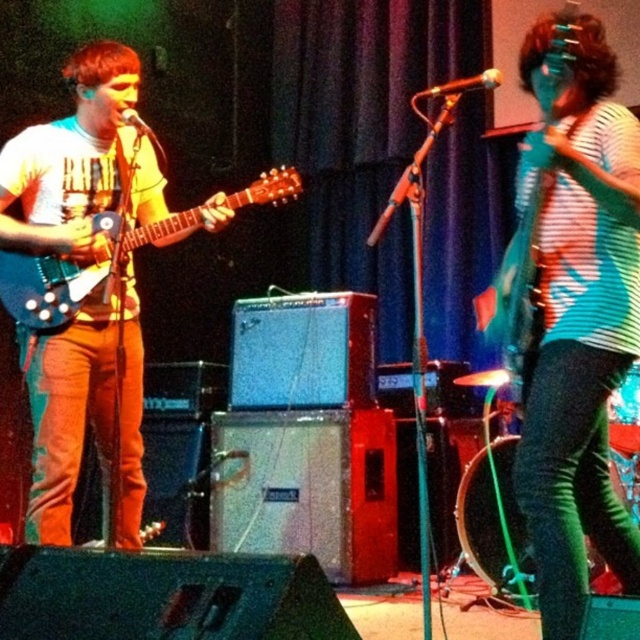
You are standing in the audience at the live music performance. You want to throw a small flower bouquet to the musician wearing the striped fabric shirt at center. Considering the distance between you and the shirt, is it feasible to accurately throw the bouquet without it going too far or falling short?

The striped fabric shirt at center and viewer are 2.15 meters apart from each other. Throwing a small flower bouquet over this distance is feasible as 2.15 meters is a manageable distance for an accurate throw, provided there are no obstacles in the way.

You are a stagehand setting up for a live show. You need to move the metallic silver microphone at upper center to the side to make space for the drummer. However, the matte black guitar at left is currently blocking the path. Can you move the microphone without moving the guitar?

The matte black guitar at left is in front of the metallic silver microphone at upper center, so moving the microphone without moving the guitar would be difficult as the guitar is blocking the path.